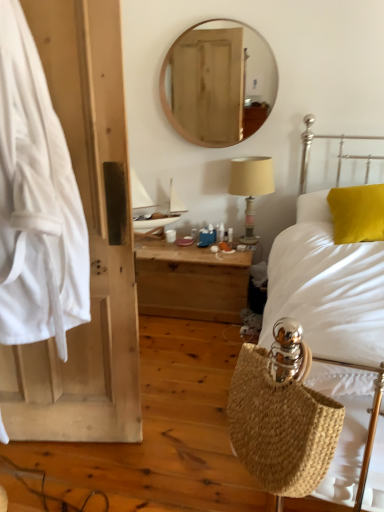
Image resolution: width=384 pixels, height=512 pixels. What do you see at coordinates (357, 213) in the screenshot? I see `yellow fabric pillow at right` at bounding box center [357, 213].

Measure the distance between point (108, 61) and camera.

The depth of point (108, 61) is 1.35 meters.

Where is `natural woven basket at lower right`? Image resolution: width=384 pixels, height=512 pixels. natural woven basket at lower right is located at coordinates (281, 424).

This screenshot has height=512, width=384. Describe the element at coordinates (217, 83) in the screenshot. I see `wooden round mirror at upper center` at that location.

The height and width of the screenshot is (512, 384). Identify the location of yellow fabric pillow at right. (357, 213).

Is wooden nightstand at center in contact with white fabric at left?

No, wooden nightstand at center is not beside white fabric at left.

Considering the relative sizes of wooden nightstand at center and white fabric at left in the image provided, is wooden nightstand at center shorter than white fabric at left?

Indeed, wooden nightstand at center has a lesser height compared to white fabric at left.

Identify the location of nightstand located below the white fabric at left (from the image's perspective). (191, 281).

Who is more distant, wooden nightstand at center or white fabric at left?

Positioned behind is wooden nightstand at center.

From a real-world perspective, is beige fabric lampshade at upper right positioned under natural woven basket at lower right based on gravity?

No, from a real-world perspective, beige fabric lampshade at upper right is not below natural woven basket at lower right.

From the image's perspective, which is below, beige fabric lampshade at upper right or natural woven basket at lower right?

natural woven basket at lower right appears lower in the image.

In the scene shown: Does beige fabric lampshade at upper right touch natural woven basket at lower right?

beige fabric lampshade at upper right and natural woven basket at lower right are not in contact.

Can you confirm if beige fabric lampshade at upper right is shorter than natural woven basket at lower right?

Incorrect, the height of beige fabric lampshade at upper right does not fall short of that of natural woven basket at lower right.

Between natural woven basket at lower right and yellow fabric pillow at right, which one has smaller width?

With smaller width is natural woven basket at lower right.

Which of these two, natural woven basket at lower right or yellow fabric pillow at right, is bigger?

yellow fabric pillow at right.

Is natural woven basket at lower right further to camera compared to yellow fabric pillow at right?

No, the depth of natural woven basket at lower right is less than that of yellow fabric pillow at right.

Does natural woven basket at lower right have a greater width compared to wooden nightstand at center?

In fact, natural woven basket at lower right might be narrower than wooden nightstand at center.

Is natural woven basket at lower right placed right next to wooden nightstand at center?

natural woven basket at lower right and wooden nightstand at center are not in contact.

Does natural woven basket at lower right turn towards wooden nightstand at center?

No, natural woven basket at lower right is not turned towards wooden nightstand at center.

From the image's perspective, would you say natural woven basket at lower right is positioned over wooden nightstand at center?

No, from the image's perspective, natural woven basket at lower right is not on top of wooden nightstand at center.

Can you tell me how much natural woven basket at lower right and beige fabric lampshade at upper right differ in facing direction?

There is a 60.1-degree angle between the facing directions of natural woven basket at lower right and beige fabric lampshade at upper right.

Looking at their sizes, would you say natural woven basket at lower right is wider or thinner than beige fabric lampshade at upper right?

In the image, natural woven basket at lower right appears to be more narrow than beige fabric lampshade at upper right.

From the image's perspective, is natural woven basket at lower right located beneath beige fabric lampshade at upper right?

Yes, from the image's perspective, natural woven basket at lower right is beneath beige fabric lampshade at upper right.

Can we say white fabric at left lies outside white woven bag at right?

Indeed, white fabric at left is completely outside white woven bag at right.

From the image's perspective, which object appears higher, white fabric at left or white woven bag at right?

white fabric at left is shown above in the image.

Is white fabric at left wider than white woven bag at right?

No, white fabric at left is not wider than white woven bag at right.

Find the location of a particular element. barn door above the white woven bag at right (from the image's perspective) is located at coordinates (89, 242).

Is beige fabric lampshade at upper right looking in the opposite direction of wooden nightstand at center?

beige fabric lampshade at upper right is not turned away from wooden nightstand at center.

In the scene shown: Would you consider beige fabric lampshade at upper right to be distant from wooden nightstand at center?

No.

Between beige fabric lampshade at upper right and wooden nightstand at center, which one is positioned in front?

wooden nightstand at center is more forward.

I want to click on nightstand located on the right of white fabric at left, so click(x=191, y=281).

Find the location of a particular element. The image size is (384, 512). table lamp above the natural woven basket at lower right (from a real-world perspective) is located at coordinates (251, 187).

Looking at the image, which one is located closer to wooden nightstand at center, beige fabric lampshade at upper right or white woven bag at right?

Among the two, beige fabric lampshade at upper right is located nearer to wooden nightstand at center.

When comparing their distances from beige fabric lampshade at upper right, does natural woven basket at lower right or yellow fabric pillow at right seem further?

Among the two, natural woven basket at lower right is located further to beige fabric lampshade at upper right.

In the scene shown: Which object lies further to the anchor point wooden nightstand at center, white fabric at left or white woven bag at right?

white woven bag at right is further to wooden nightstand at center.

Estimate the real-world distances between objects in this image. Which object is closer to wooden nightstand at center, yellow fabric pillow at right or wooden round mirror at upper center?

yellow fabric pillow at right is positioned closer to the anchor wooden nightstand at center.

Estimate the real-world distances between objects in this image. Which object is further from white fabric at left, white woven bag at right or beige fabric lampshade at upper right?

white woven bag at right lies further to white fabric at left than the other object.

Consider the image. Which object lies nearer to the anchor point yellow fabric pillow at right, white woven bag at right or wooden round mirror at upper center?

white woven bag at right is closer to yellow fabric pillow at right.

Considering their positions, is beige fabric lampshade at upper right positioned closer to white fabric at left than wooden round mirror at upper center?

beige fabric lampshade at upper right.

Considering their positions, is yellow fabric pillow at right positioned closer to white woven bag at right than natural woven basket at lower right?

The object closer to white woven bag at right is yellow fabric pillow at right.

Identify the location of table lamp between wooden nightstand at center and yellow fabric pillow at right. (251, 187).

The image size is (384, 512). In order to click on basket located between white woven bag at right and yellow fabric pillow at right in the depth direction in this screenshot , I will do `click(281, 424)`.

Identify the location of basket between white woven bag at right and wooden nightstand at center from front to back. This screenshot has width=384, height=512. (281, 424).

At what (x,y) coordinates should I click in order to perform the action: click on pillow between white woven bag at right and beige fabric lampshade at upper right along the z-axis. Please return your answer as a coordinate pair (x, y). Looking at the image, I should click on [357, 213].